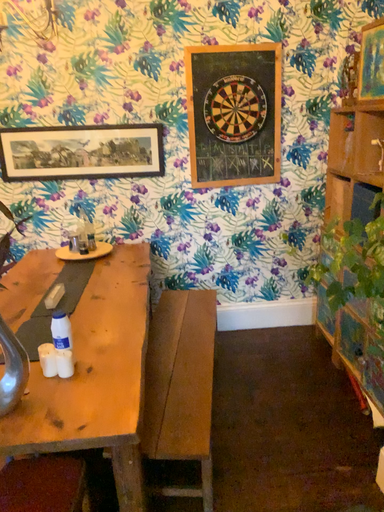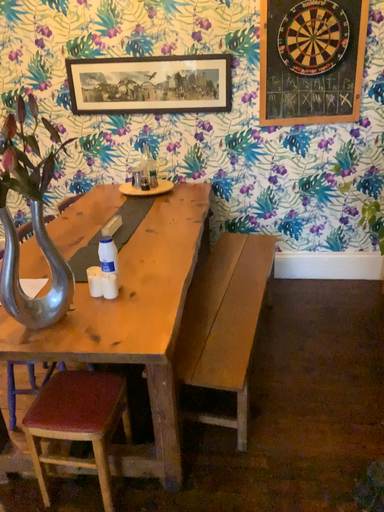
Question: How did the camera likely rotate when shooting the video?

Choices:
 (A) rotated left
 (B) rotated right

Answer: (A)